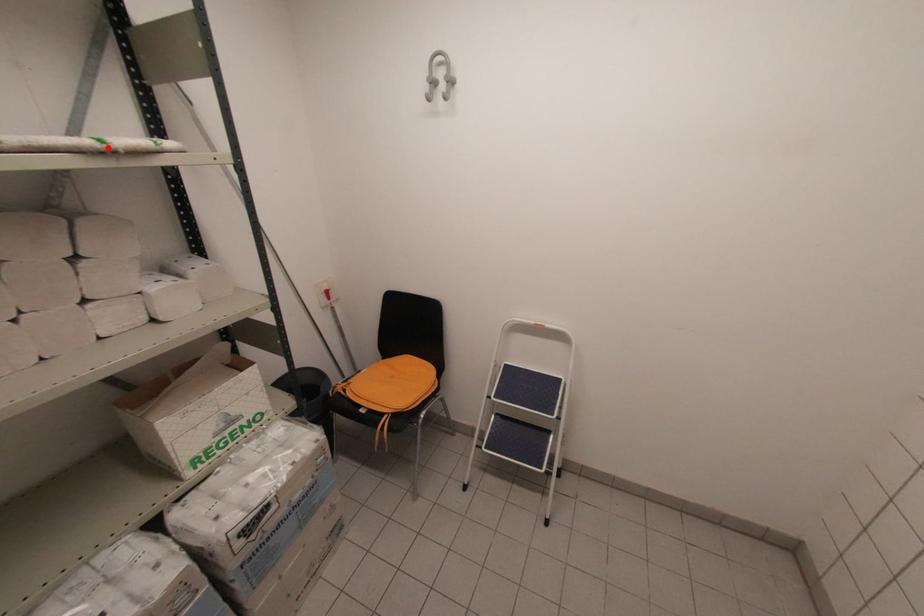
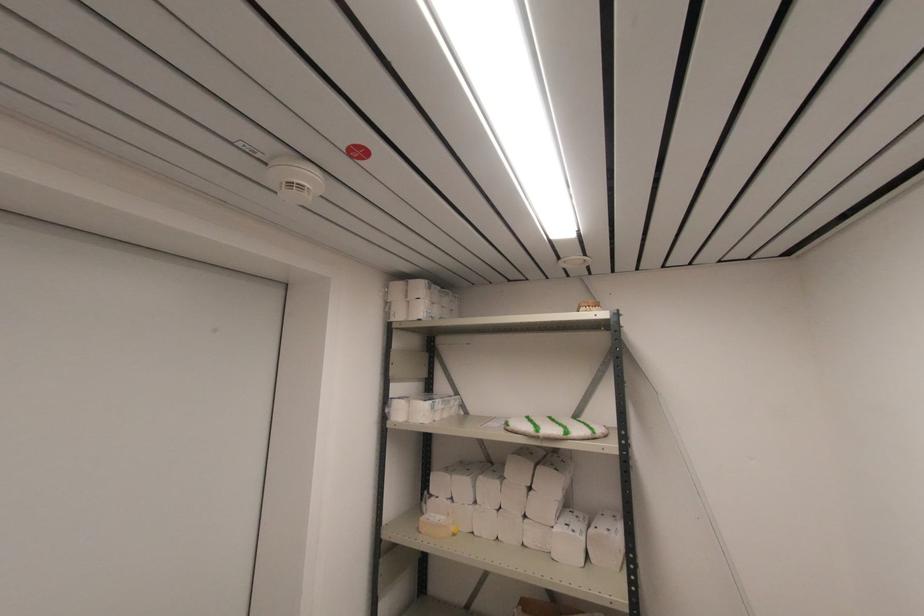
Find the pixel in the second image that matches the highlighted location in the first image.

(537, 436)